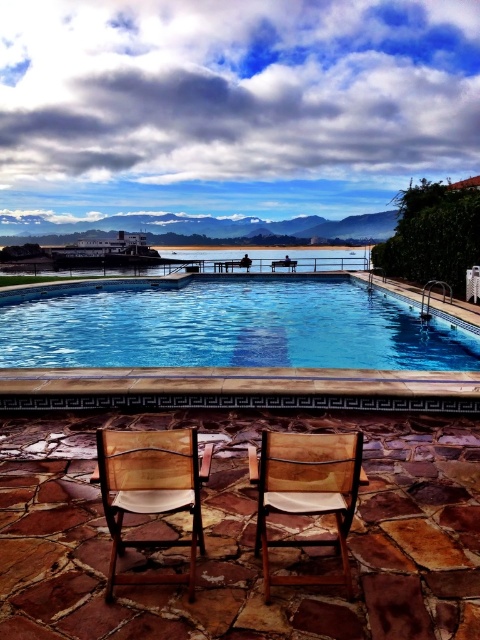
Question: Is wooden chair at lower center above wooden chair with white cushion at center?

Choices:
 (A) yes
 (B) no

Answer: (A)

Question: Does blue glassy swimming pool at center lie in front of wooden chair with white cushion at center?

Choices:
 (A) no
 (B) yes

Answer: (A)

Question: Can you confirm if blue glassy swimming pool at center is positioned below wooden chair with white cushion at center?

Choices:
 (A) no
 (B) yes

Answer: (A)

Question: Which point is farther to the camera?

Choices:
 (A) wooden chair with white cushion at center
 (B) blue glassy swimming pool at center
 (C) wooden chair at lower center

Answer: (B)

Question: Which point is closer to the camera?

Choices:
 (A) (153, 451)
 (B) (254, 554)
 (C) (191, 324)

Answer: (A)

Question: Which of the following is the closest to the observer?

Choices:
 (A) blue glassy swimming pool at center
 (B) wooden chair with white cushion at center
 (C) wooden chair at lower center

Answer: (C)